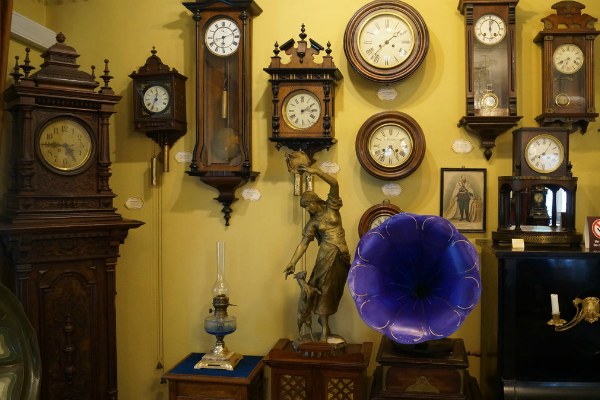
Locate an element on the screen. The image size is (600, 400). clock faces is located at coordinates (68, 147), (150, 102), (222, 34), (307, 110), (380, 44), (384, 150), (489, 31), (571, 57), (544, 155), (377, 222).